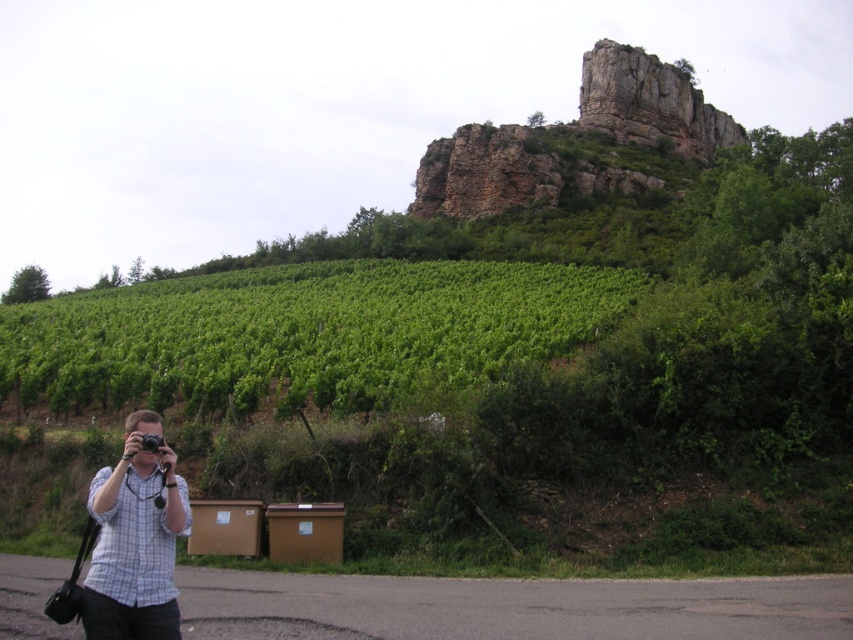
What is located at the coordinates point (576, 134) in the image?

The coordinates point (576, 134) indicate a rusty stone cliff at upper center.

You are a hiker who wants to take a photo of the rusty stone cliff at upper center while standing near the white checkered shirt at lower left. Is the cliff visible from your current position?

The rusty stone cliff at upper center is positioned over the white checkered shirt at lower left, so yes, the cliff is visible from the position near the white checkered shirt at lower left.

You are a photographer positioned on the paved road in the foreground. You want to capture a photo that includes both the man with the camera and the rusty stone cliff at upper center. Based on their positions, will the cliff be visible in the background of the photo if you frame the man in the foreground?

The rusty stone cliff at upper center is located at point (576,134), which means it is positioned in the upper center of the image. Since the man is in the foreground on the paved road and the cliff is in the upper center background, the cliff will be visible in the background of the photo when framing the man.